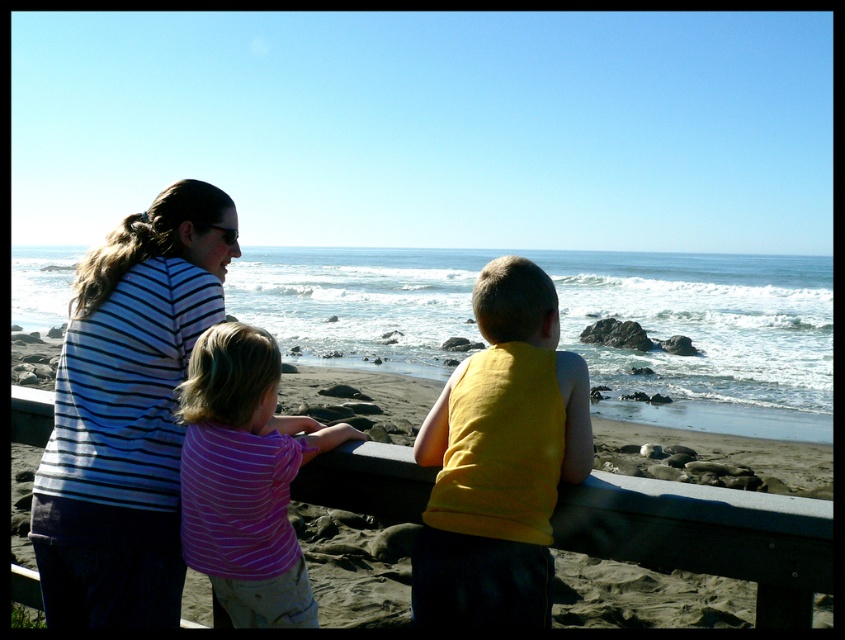
You are standing at the beach and looking at the wooden railing where the three people are standing. There are two points marked on the railing at coordinates point (178,333) and point (459,384). If you want to place a small flag closer to you, which point should you choose?

Point (178,333) is further to the camera than point (459,384), so you should choose point (178,333) to place the small flag closer to you.

You are standing on the wooden railing overlooking the ocean. There are two points marked on the railing. The first point is at coordinates point (x=444, y=621) and the second is at point (x=255, y=332). If you face the ocean, which point is closer to you?

Point (x=444, y=621) is in front of point (x=255, y=332), so when facing the ocean, point (x=444, y=621) is closer to you.

You are a tailor who needs to determine which shirt requires more fabric to make between the striped fabric shirt at left and the purple striped shirt at center. Based on the scene, which one would need more fabric?

The striped fabric shirt at left requires more fabric because it is larger in size than the purple striped shirt at center.